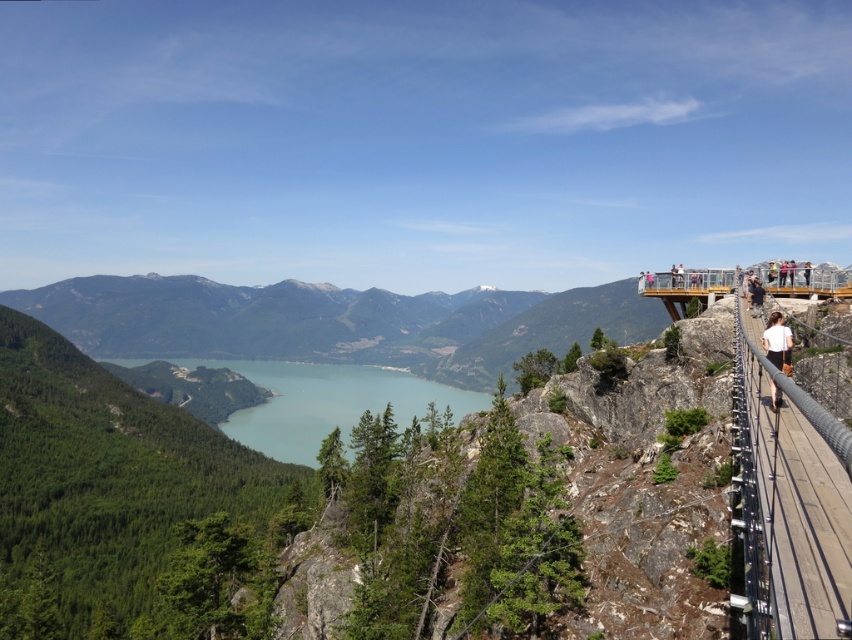
Question: Among these points, which one is farthest from the camera?

Choices:
 (A) (314, 406)
 (B) (767, 330)
 (C) (787, 618)

Answer: (A)

Question: Which point is closer to the camera?

Choices:
 (A) (415, 387)
 (B) (774, 320)
 (C) (738, 339)

Answer: (B)

Question: Which point appears farthest from the camera in this image?

Choices:
 (A) (773, 390)
 (B) (780, 429)

Answer: (A)

Question: Is blue glassy lake at center to the right of white cotton shirt at right from the viewer's perspective?

Choices:
 (A) yes
 (B) no

Answer: (B)

Question: Considering the relative positions of wooden walkway at right and blue glassy lake at center in the image provided, where is wooden walkway at right located with respect to blue glassy lake at center?

Choices:
 (A) above
 (B) below

Answer: (A)

Question: Is wooden walkway at right in front of white cotton shirt at right?

Choices:
 (A) no
 (B) yes

Answer: (B)